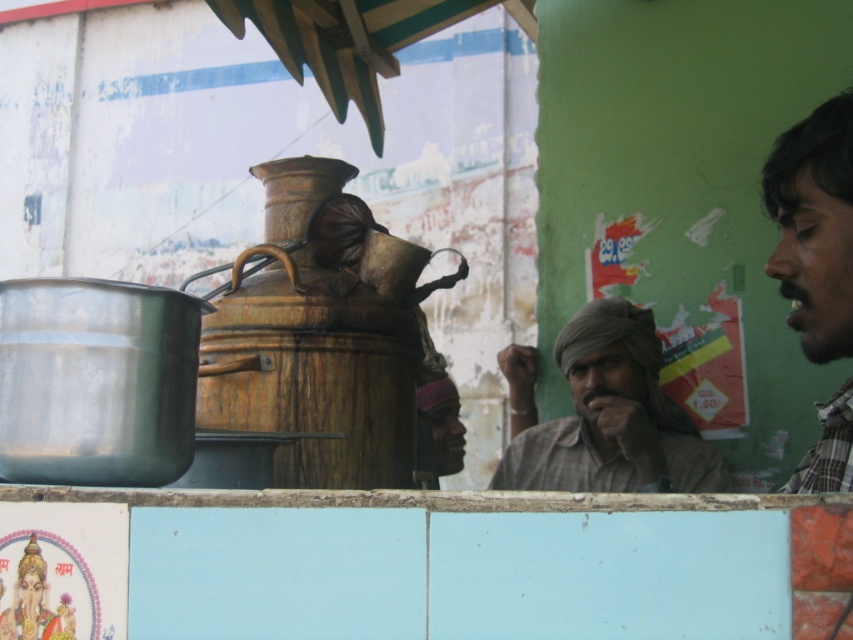
You are a photographer standing in front of the metallic pot on the left. You want to take a picture of the two men wearing the brown textured shirt at center and the dark brown plaid shirt at right. Which shirt should you look to your right to capture in the frame?

The dark brown plaid shirt at right is to the right of the brown textured shirt at center, so you should look to your right to capture the dark brown plaid shirt at right in the frame.